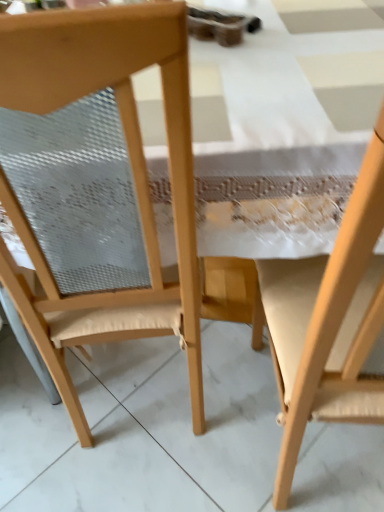
Question: Can you confirm if wooden chair at left, arranged as the 2th chair when viewed from the right, is shorter than wooden chair at right, which is the second chair from left to right?

Choices:
 (A) no
 (B) yes

Answer: (A)

Question: Does wooden chair at left, arranged as the 2th chair when viewed from the right, have a smaller size compared to wooden chair at right, marked as the first chair in a right-to-left arrangement?

Choices:
 (A) no
 (B) yes

Answer: (B)

Question: Would you say wooden chair at left, placed as the first chair when sorted from left to right, is outside wooden chair at right, marked as the first chair in a right-to-left arrangement?

Choices:
 (A) no
 (B) yes

Answer: (B)

Question: Does wooden chair at left, placed as the first chair when sorted from left to right, have a greater width compared to wooden chair at right, marked as the first chair in a right-to-left arrangement?

Choices:
 (A) yes
 (B) no

Answer: (B)

Question: Is the position of wooden chair at left, placed as the first chair when sorted from left to right, more distant than that of wooden chair at right, which is the second chair from left to right?

Choices:
 (A) no
 (B) yes

Answer: (B)

Question: Is wooden chair at left, arranged as the 2th chair when viewed from the right, oriented away from wooden chair at right, marked as the first chair in a right-to-left arrangement?

Choices:
 (A) no
 (B) yes

Answer: (A)

Question: Can you confirm if wooden chair at right, marked as the first chair in a right-to-left arrangement, is positioned to the left of wooden chair at left, arranged as the 2th chair when viewed from the right?

Choices:
 (A) no
 (B) yes

Answer: (A)

Question: Can you confirm if wooden chair at right, marked as the first chair in a right-to-left arrangement, is taller than wooden chair at left, arranged as the 2th chair when viewed from the right?

Choices:
 (A) yes
 (B) no

Answer: (B)

Question: Does wooden chair at right, which is the second chair from left to right, have a larger size compared to wooden chair at left, placed as the first chair when sorted from left to right?

Choices:
 (A) yes
 (B) no

Answer: (A)

Question: Is wooden chair at right, which is the second chair from left to right, shorter than wooden chair at left, placed as the first chair when sorted from left to right?

Choices:
 (A) yes
 (B) no

Answer: (A)

Question: Is wooden chair at right, which is the second chair from left to right, further to the viewer compared to wooden chair at left, placed as the first chair when sorted from left to right?

Choices:
 (A) no
 (B) yes

Answer: (A)

Question: Is wooden chair at right, which is the second chair from left to right, oriented away from wooden chair at left, placed as the first chair when sorted from left to right?

Choices:
 (A) no
 (B) yes

Answer: (A)

Question: Do you think wooden chair at left, placed as the first chair when sorted from left to right, is within wooden chair at right, which is the second chair from left to right, or outside of it?

Choices:
 (A) inside
 (B) outside

Answer: (B)